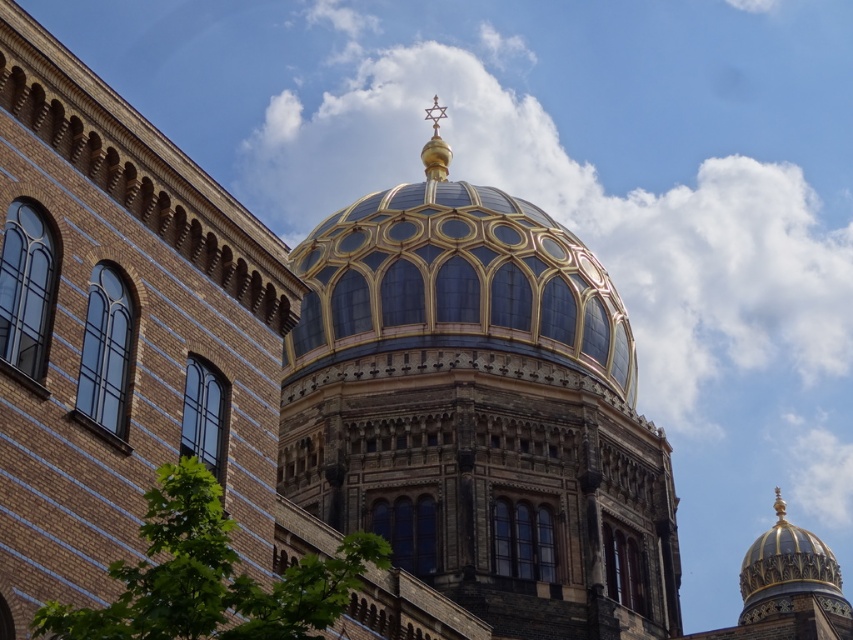
Is gold-gilded dome at center thinner than gold/gilded dome at center?

Indeed, gold-gilded dome at center has a lesser width compared to gold/gilded dome at center.

Is gold-gilded dome at center smaller than gold/gilded dome at center?

Indeed, gold-gilded dome at center has a smaller size compared to gold/gilded dome at center.

Identify the location of gold-gilded dome at center. (479, 410).

Where is `gold-gilded dome at center`? The height and width of the screenshot is (640, 853). gold-gilded dome at center is located at coordinates (479, 410).